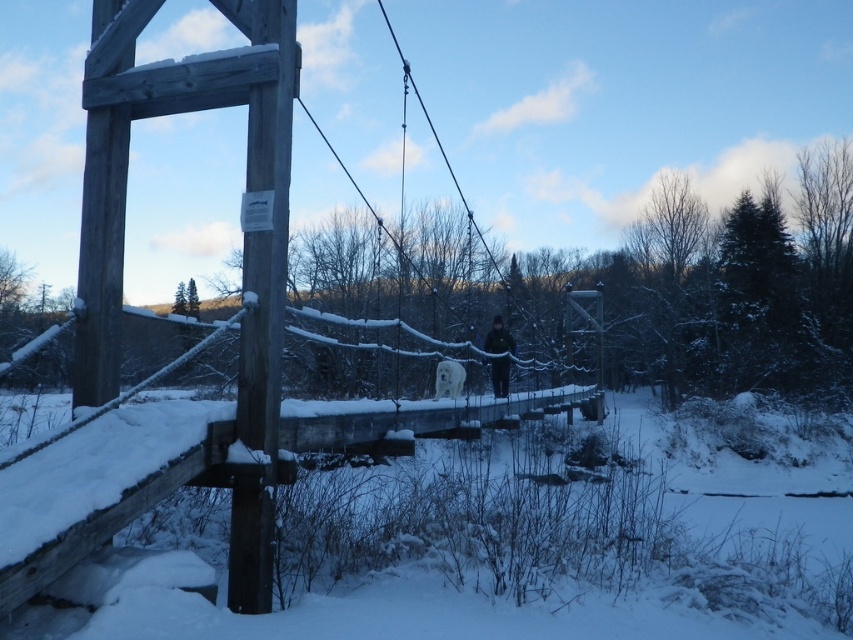
Which is in front, point (271, 186) or point (494, 353)?

Point (271, 186) is in front.

Can you confirm if wooden suspension bridge at center is bigger than dark brown jacket at center?

Incorrect, wooden suspension bridge at center is not larger than dark brown jacket at center.

At what (x,y) coordinates should I click in order to perform the action: click on wooden suspension bridge at center. Please return your answer as a coordinate pair (x, y). Image resolution: width=853 pixels, height=640 pixels. Looking at the image, I should click on (241, 280).

Locate an element on the screen. The width and height of the screenshot is (853, 640). wooden suspension bridge at center is located at coordinates 241,280.